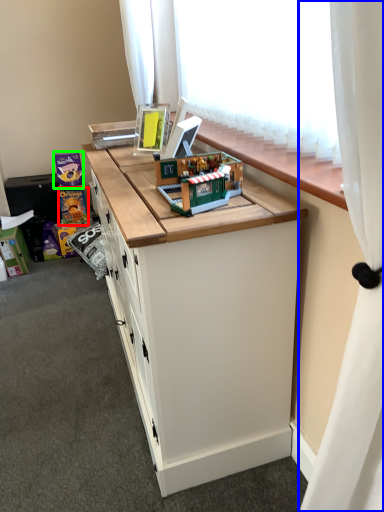
Question: Which object is the farthest from toy (highlighted by a red box)? Choose among these: curtain (highlighted by a blue box) or toy (highlighted by a green box).

Choices:
 (A) curtain
 (B) toy

Answer: (A)